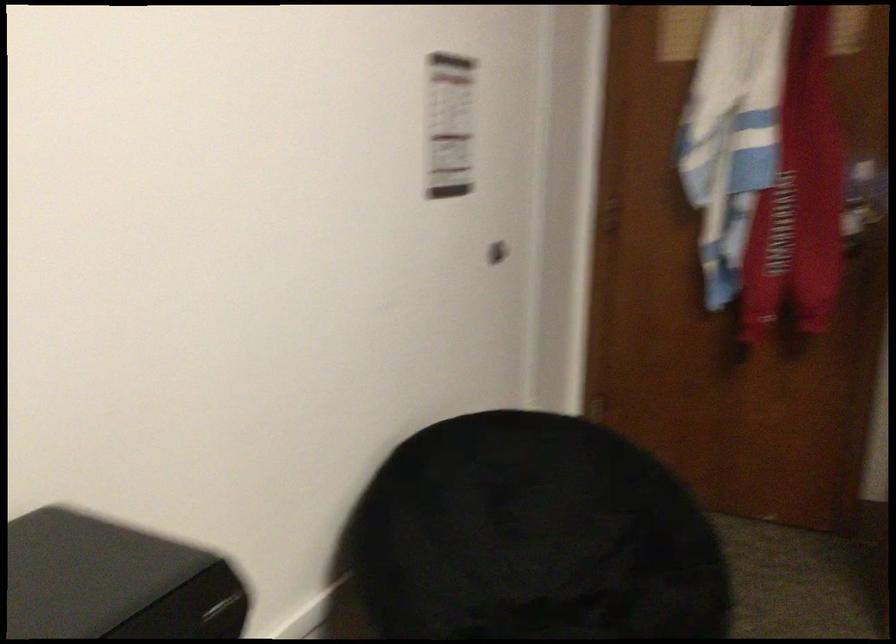
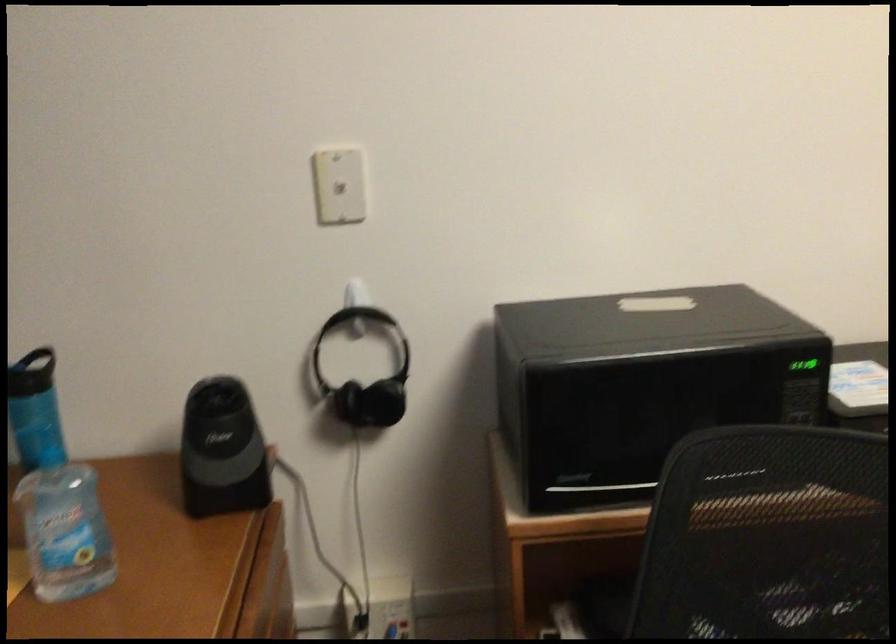
Question: How did the camera likely rotate?

Choices:
 (A) Left
 (B) Right
 (C) Up
 (D) Down

Answer: (A)